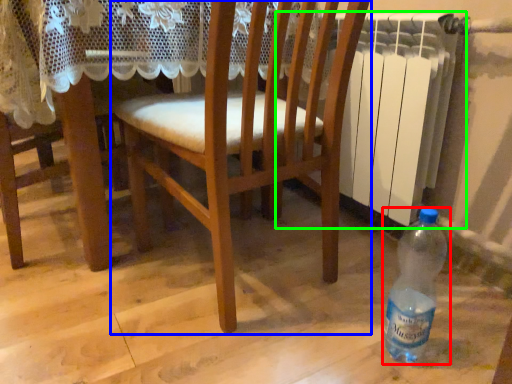
Question: Which is nearer to the bottle (highlighted by a red box)? chair (highlighted by a blue box) or radiator (highlighted by a green box).

Choices:
 (A) chair
 (B) radiator

Answer: (A)